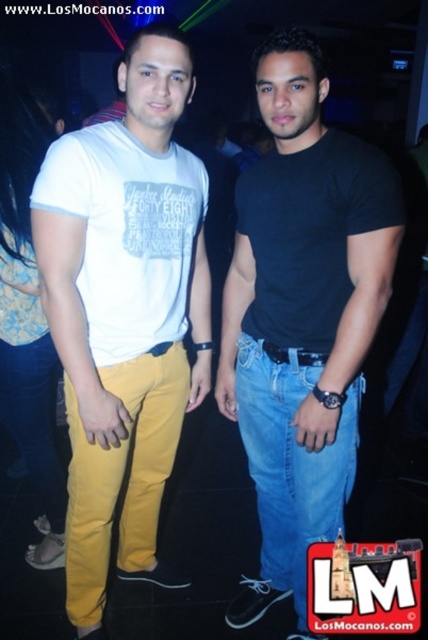
You are a photographer at a party trying to capture a clear shot of the matte yellow pants at left and the blue denim jeans at center. Since the lighting is low, you need to adjust your camera settings. Considering their positions, which object should you focus on first to ensure both are in sharp focus?

The matte yellow pants at left is in front of the blue denim jeans at center. To ensure both are in sharp focus, you should focus on the matte yellow pants at left first, as it is closer to the camera. This way, the depth of field will extend from the matte yellow pants at left to the blue denim jeans at center, increasing the likelihood of both being in focus.

You are standing at the point marked as point (143, 232) in the image. You want to reach the entrance of the venue, which is located 10 feet away from your current position. Can you estimate whether you can walk straight to the entrance without encountering any obstacles?

The distance between point (143, 232) and the viewer is 4.84 feet. Since the entrance is 10 feet away, you would need to walk an additional 5.16 feet beyond your current position to reach it. However, without information about potential obstacles in the path, it is impossible to determine if the route is clear. Please check for any people or objects in your way before proceeding.